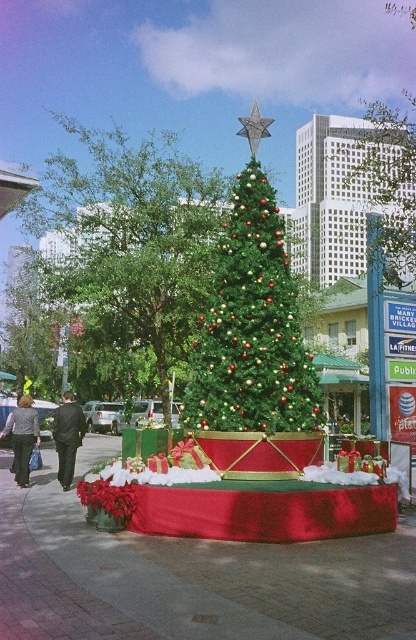
You are attending a holiday party and see a dark suit at center and black textured pants at lower left. Which clothing item appears narrower when viewed from your perspective?

The dark suit at center appears narrower than the black textured pants at lower left.

Consider the image. You are planning to decorate both the green shiny christmas tree at center and the green textured christmas tree at center. Based on their sizes, which tree will require more ladder steps to reach the top?

The green shiny christmas tree at center is taller than the green textured christmas tree at center, so it will require more ladder steps to reach the top.